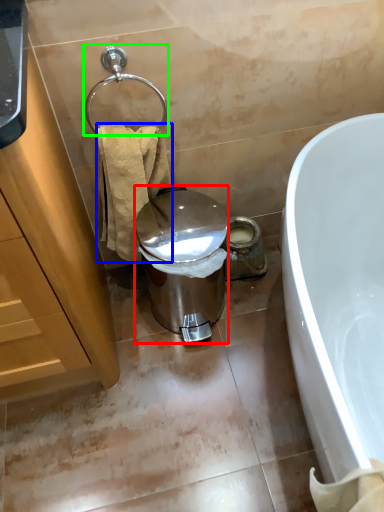
Question: Which object is the closest to the trash bin/can (highlighted by a red box)? Choose among these: towel/napkin (highlighted by a blue box) or shower (highlighted by a green box).

Choices:
 (A) towel/napkin
 (B) shower

Answer: (A)